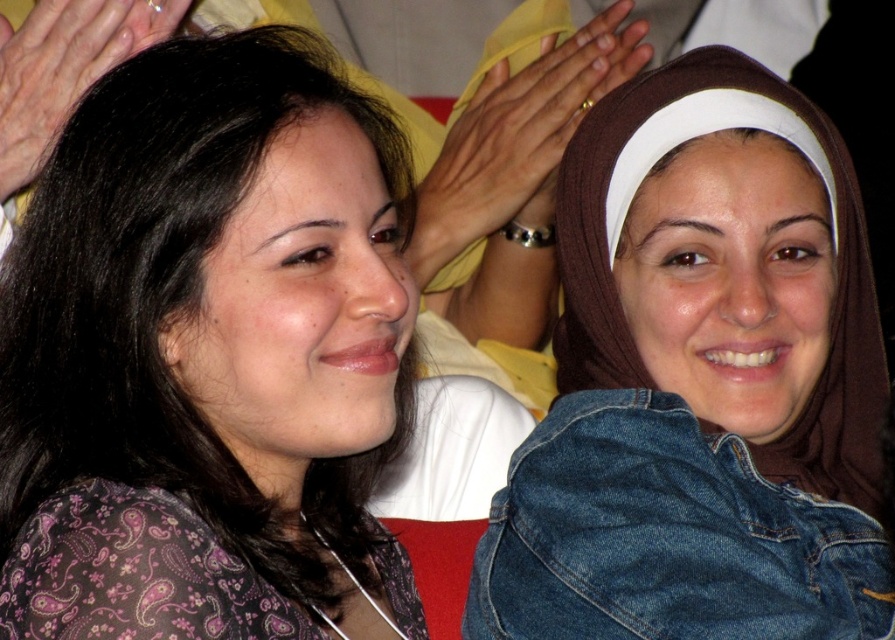
Is brown denim jacket at upper right to the left of metallic ring at upper center from the viewer's perspective?

In fact, brown denim jacket at upper right is to the right of metallic ring at upper center.

Does point (692, 220) lie behind point (465, 152)?

That is False.

Is point (734, 417) in front of point (422, 252)?

Yes.

Where is `brown denim jacket at upper right`? brown denim jacket at upper right is located at coordinates (701, 381).

Is brown denim jacket at upper right shorter than matte black hair at upper left?

In fact, brown denim jacket at upper right may be taller than matte black hair at upper left.

Between brown denim jacket at upper right and matte black hair at upper left, which one appears on the right side from the viewer's perspective?

brown denim jacket at upper right is more to the right.

What do you see at coordinates (701, 381) in the screenshot? I see `brown denim jacket at upper right` at bounding box center [701, 381].

Identify the location of brown denim jacket at upper right. (701, 381).

Which of these two, metallic ring at upper center or matte black hair at upper left, stands taller?

metallic ring at upper center is taller.

Can you confirm if metallic ring at upper center is bigger than matte black hair at upper left?

Yes, metallic ring at upper center is bigger than matte black hair at upper left.

Between point (548, 116) and point (26, 54), which one is positioned in front?

Point (26, 54) is in front.

Identify the location of metallic ring at upper center. (517, 136).